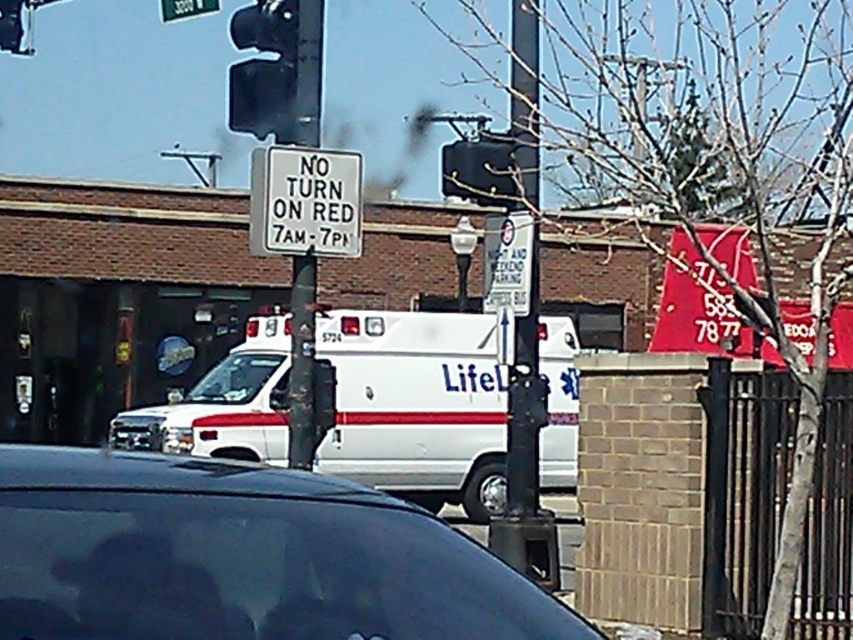
You are a pedestrian standing at the intersection and see the shiny black car at center and the white plastic sign at upper center. Which object is positioned to the left?

The white plastic sign at upper center is positioned to the left of the shiny black car at center.

You are a driver approaching an intersection with a black plastic traffic light at upper center and a white plastic sign at center. Which object is wider?

The black plastic traffic light at upper center is wider than the white plastic sign at center.

You are a driver approaching an intersection and see the metallic pole at center and the white plastic sign at center. Which object is larger in size?

The white plastic sign at center is larger than the metallic pole at center.